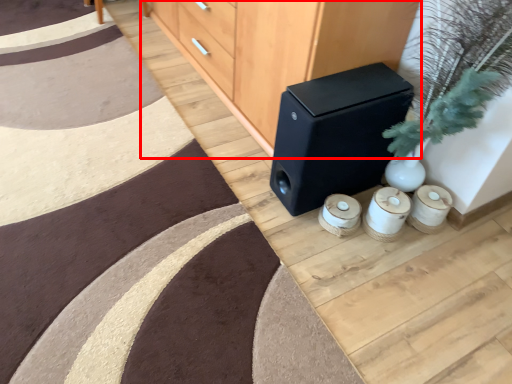
Question: From the image's perspective, what is the correct spatial positioning of furniture (annotated by the red box) in reference to speaker?

Choices:
 (A) below
 (B) above

Answer: (B)